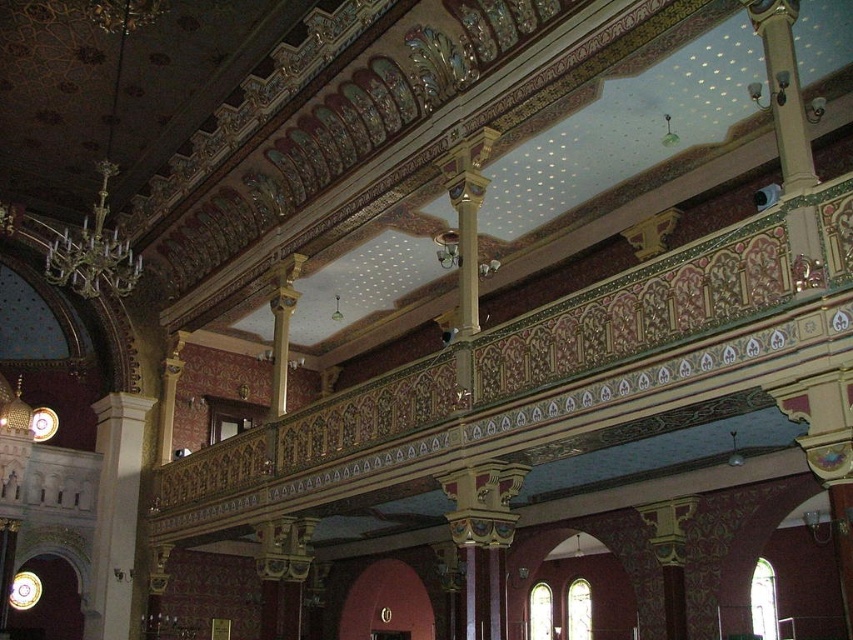
Question: In this image, where is white marble column at left located relative to gold-bronze chandelier at upper left?

Choices:
 (A) below
 (B) above

Answer: (A)

Question: Which point is farther from the camera taking this photo?

Choices:
 (A) (122, 256)
 (B) (123, 451)

Answer: (B)

Question: Can you confirm if white marble column at left is positioned below gold-bronze chandelier at upper left?

Choices:
 (A) no
 (B) yes

Answer: (B)

Question: Is white marble column at left to the right of gold-bronze chandelier at upper left from the viewer's perspective?

Choices:
 (A) yes
 (B) no

Answer: (B)

Question: Which point is closer to the camera?

Choices:
 (A) (61, 260)
 (B) (119, 604)

Answer: (A)

Question: Which of the following is the closest to the observer?

Choices:
 (A) (115, 481)
 (B) (64, 252)

Answer: (B)